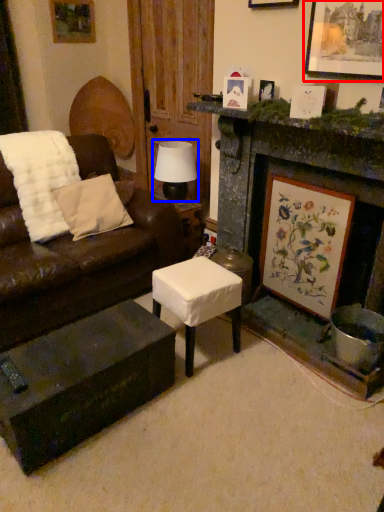
Question: Which of the following is the closest to the observer, picture frame (highlighted by a red box) or table lamp (highlighted by a blue box)?

Choices:
 (A) picture frame
 (B) table lamp

Answer: (A)